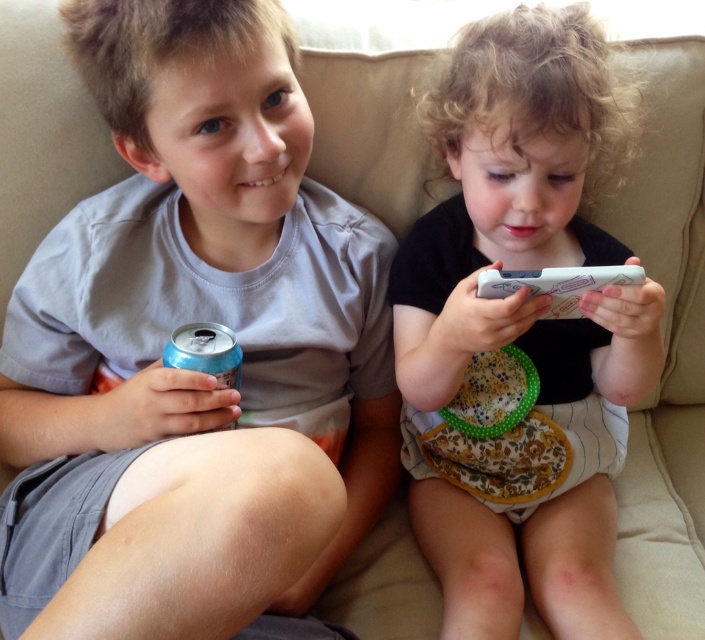
Is matte blue can at left smaller than white plastic remote at center?

Actually, matte blue can at left might be larger than white plastic remote at center.

Image resolution: width=705 pixels, height=640 pixels. Identify the location of matte blue can at left. [185, 369].

Is point (580, 144) closer to camera compared to point (560, 275)?

No, it is not.

Who is lower down, black fabric phone at center or white plastic remote at center?

black fabric phone at center is below.

Is point (541, 108) closer to viewer compared to point (568, 282)?

No.

What are the coordinates of `black fabric phone at center` in the screenshot? It's located at (525, 324).

In order to click on white plastic remote at center in this screenshot , I will do `click(556, 284)`.

Is point (576, 276) positioned behind point (202, 337)?

No, it is not.

Where is `white plastic remote at center`? This screenshot has height=640, width=705. white plastic remote at center is located at coordinates (556, 284).

In order to click on white plastic remote at center in this screenshot , I will do `click(556, 284)`.